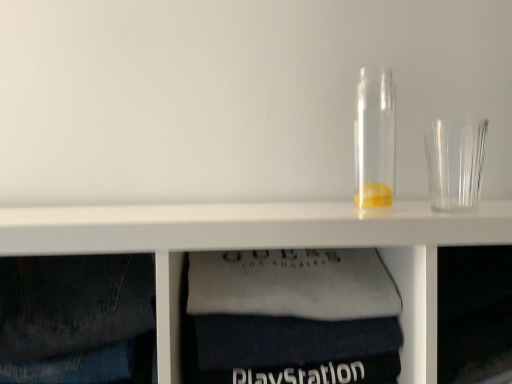
What do you see at coordinates (455, 163) in the screenshot? I see `transparent plastic shot glass at right` at bounding box center [455, 163].

Based on the photo, measure the distance between white fabric at lower center and camera.

A distance of 23.78 inches exists between white fabric at lower center and camera.

Image resolution: width=512 pixels, height=384 pixels. In order to click on transparent plastic shot glass at right in this screenshot , I will do `click(455, 163)`.

Can you tell me how much white fabric at lower center and transparent plastic shot glass at right differ in facing direction?

white fabric at lower center and transparent plastic shot glass at right are facing 2.62 degrees away from each other.

Is white fabric at lower center wider than transparent plastic shot glass at right?

Yes.

Considering the positions of objects white fabric at lower center and transparent plastic shot glass at right in the image provided, who is more to the left, white fabric at lower center or transparent plastic shot glass at right?

white fabric at lower center is more to the left.

In the scene shown: Does white fabric at lower center have a greater height compared to transparent plastic shot glass at right?

Indeed, white fabric at lower center has a greater height compared to transparent plastic shot glass at right.

How much distance is there between transparent glass jar at center and white fabric at lower center?

A distance of 23.97 centimeters exists between transparent glass jar at center and white fabric at lower center.

From a real-world perspective, which object stands above the other?

transparent glass jar at center is physically above.

How different are the orientations of transparent glass jar at center and white fabric at lower center in degrees?

The facing directions of transparent glass jar at center and white fabric at lower center are 2.62 degrees apart.

Considering the sizes of objects transparent glass jar at center and white fabric at lower center in the image provided, who is shorter, transparent glass jar at center or white fabric at lower center?

With less height is transparent glass jar at center.

Considering the sizes of objects transparent glass jar at center and transparent plastic shot glass at right in the image provided, who is bigger, transparent glass jar at center or transparent plastic shot glass at right?

transparent glass jar at center is bigger.

From the image's perspective, which one is positioned higher, transparent glass jar at center or transparent plastic shot glass at right?

transparent glass jar at center.

Are transparent glass jar at center and transparent plastic shot glass at right located far from each other?

That's not correct — transparent glass jar at center is a little close to transparent plastic shot glass at right.

Would you say transparent glass jar at center is part of transparent plastic shot glass at right's contents?

That's incorrect, transparent glass jar at center is not inside transparent plastic shot glass at right.

Looking at this image, from a real-world perspective, is transparent plastic shot glass at right over transparent glass jar at center?

Incorrect, from a real-world perspective, transparent plastic shot glass at right is lower than transparent glass jar at center.

Is transparent plastic shot glass at right beside transparent glass jar at center?

There is a gap between transparent plastic shot glass at right and transparent glass jar at center.

Is transparent plastic shot glass at right wider or thinner than white fabric at lower center?

In the image, transparent plastic shot glass at right appears to be more narrow than white fabric at lower center.

From the image's perspective, is transparent plastic shot glass at right positioned above or below white fabric at lower center?

From the image's perspective, transparent plastic shot glass at right appears above white fabric at lower center.

From their relative heights in the image, would you say transparent plastic shot glass at right is taller or shorter than white fabric at lower center?

Clearly, transparent plastic shot glass at right is shorter compared to white fabric at lower center.

Considering the positions of objects transparent plastic shot glass at right and white fabric at lower center in the image provided, who is behind, transparent plastic shot glass at right or white fabric at lower center?

transparent plastic shot glass at right.

Considering the relative positions of white fabric at lower center and transparent glass jar at center in the image provided, is white fabric at lower center in front of transparent glass jar at center?

That is True.

Would you say white fabric at lower center is a long distance from transparent glass jar at center?

Actually, white fabric at lower center and transparent glass jar at center are a little close together.

Which of these two, white fabric at lower center or transparent glass jar at center, stands shorter?

With less height is transparent glass jar at center.

Find the location of a particular element. The image size is (512, 384). shot glass on the right of white fabric at lower center is located at coordinates (455, 163).

Where is `cabinet located underneath the transparent glass jar at center (from a real-world perspective)`? This screenshot has width=512, height=384. cabinet located underneath the transparent glass jar at center (from a real-world perspective) is located at coordinates (290, 318).

Looking at the image, which one is located further to transparent glass jar at center, white fabric at lower center or transparent plastic shot glass at right?

white fabric at lower center.

Estimate the real-world distances between objects in this image. Which object is closer to white fabric at lower center, transparent glass jar at center or transparent plastic shot glass at right?

Among the two, transparent glass jar at center is located nearer to white fabric at lower center.

Based on their spatial positions, is white fabric at lower center or transparent glass jar at center closer to transparent plastic shot glass at right?

transparent glass jar at center is positioned closer to the anchor transparent plastic shot glass at right.

When comparing their distances from white fabric at lower center, does transparent plastic shot glass at right or transparent glass jar at center seem further?

Among the two, transparent plastic shot glass at right is located further to white fabric at lower center.

Estimate the real-world distances between objects in this image. Which object is further from transparent plastic shot glass at right, transparent glass jar at center or white fabric at lower center?

white fabric at lower center lies further to transparent plastic shot glass at right than the other object.

Which object lies nearer to the anchor point transparent glass jar at center, transparent plastic shot glass at right or white fabric at lower center?

transparent plastic shot glass at right is closer to transparent glass jar at center.

Locate an element on the screen. The height and width of the screenshot is (384, 512). shot glass between transparent glass jar at center and white fabric at lower center vertically is located at coordinates (455, 163).